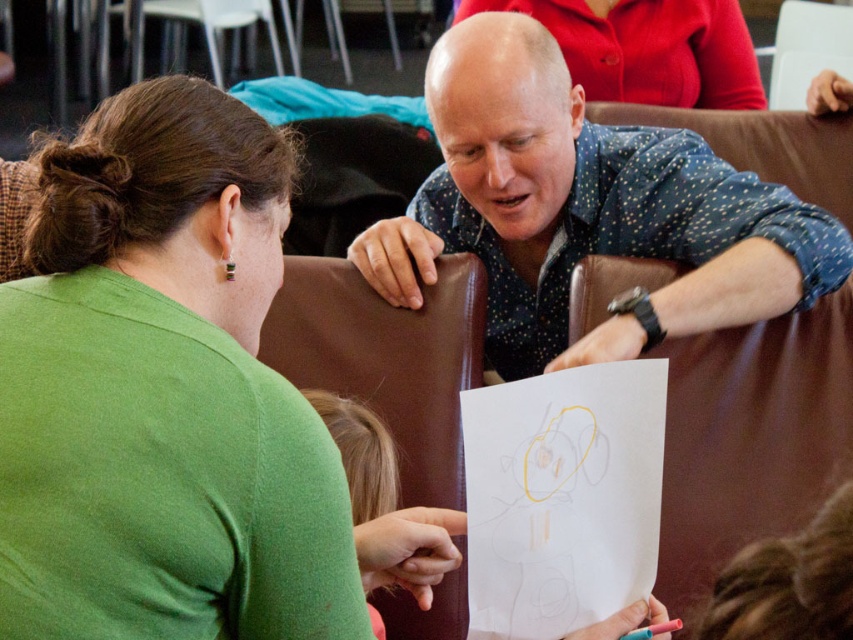
Question: Among these points, which one is farthest from the camera?

Choices:
 (A) (390, 442)
 (B) (138, 116)
 (C) (833, 285)

Answer: (C)

Question: Can you confirm if green matte shirt at upper left is wider than blue dotted shirt at upper center?

Choices:
 (A) no
 (B) yes

Answer: (A)

Question: Where is green matte shirt at upper left located in relation to blonde hair at lower center in the image?

Choices:
 (A) below
 (B) above

Answer: (B)

Question: Which of the following is the closest to the observer?

Choices:
 (A) (350, 419)
 (B) (786, 276)
 (C) (236, 358)

Answer: (C)

Question: Is blue dotted shirt at upper center above blonde hair at lower center?

Choices:
 (A) no
 (B) yes

Answer: (B)

Question: Which of the following is the closest to the observer?

Choices:
 (A) (42, 390)
 (B) (370, 481)

Answer: (A)